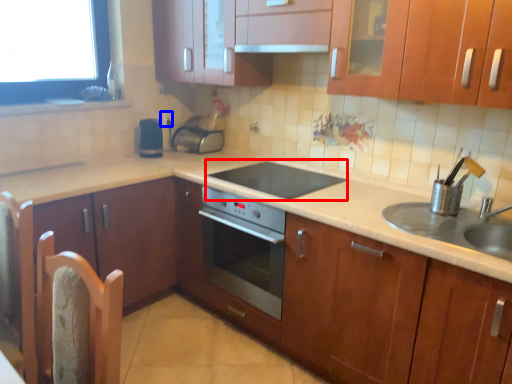
Question: Which point is closer to the camera, gas stove (highlighted by a red box) or electric outlet (highlighted by a blue box)?

Choices:
 (A) gas stove
 (B) electric outlet

Answer: (A)